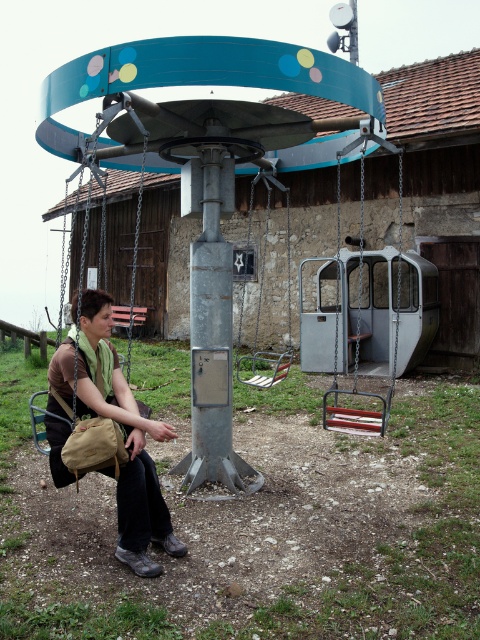
Does khaki canvas bag at lower left have a lesser height compared to metallic swing at center?

Yes, khaki canvas bag at lower left is shorter than metallic swing at center.

At what (x,y) coordinates should I click in order to perform the action: click on khaki canvas bag at lower left. Please return your answer as a coordinate pair (x, y). Looking at the image, I should click on (127, 440).

Does khaki canvas bag at lower left have a greater height compared to metallic silver swing at center?

In fact, khaki canvas bag at lower left may be shorter than metallic silver swing at center.

Consider the image. Can you confirm if khaki canvas bag at lower left is wider than metallic silver swing at center?

No.

Find the location of `khaki canvas bag at lower left`. khaki canvas bag at lower left is located at coordinates (127, 440).

Where is `khaki canvas bag at lower left`? Image resolution: width=480 pixels, height=640 pixels. khaki canvas bag at lower left is located at coordinates [127, 440].

How much distance is there between metallic swing at center and metallic silver swing at center?

metallic swing at center and metallic silver swing at center are 5.39 feet apart from each other.

Does metallic swing at center appear on the right side of metallic silver swing at center?

Indeed, metallic swing at center is positioned on the right side of metallic silver swing at center.

Between point (399, 292) and point (242, 289), which one is positioned in front?

Point (399, 292)

Identify the location of metallic swing at center. (359, 342).